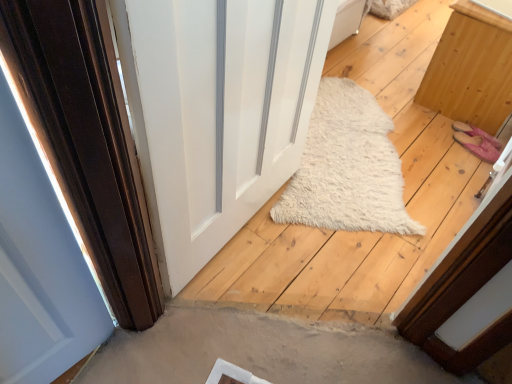
What do you see at coordinates (471, 69) in the screenshot?
I see `light brown wood cabinet at right` at bounding box center [471, 69].

Measure the distance between light brown wood cabinet at right and camera.

The distance of light brown wood cabinet at right from camera is 1.72 meters.

In order to face light brown wood cabinet at right, should I rotate leftwards or rightwards?

Rotate right and turn 29.978 degrees.

The height and width of the screenshot is (384, 512). What are the coordinates of `light brown wood cabinet at right` in the screenshot? It's located at (471, 69).

This screenshot has width=512, height=384. Describe the element at coordinates (217, 112) in the screenshot. I see `white glossy door at center` at that location.

Find the location of a particular element. white glossy door at center is located at coordinates (217, 112).

Where is `light brown wood cabinet at right`? The width and height of the screenshot is (512, 384). light brown wood cabinet at right is located at coordinates (471, 69).

Can you confirm if light brown wood cabinet at right is positioned to the right of white glossy door at center?

Indeed, light brown wood cabinet at right is positioned on the right side of white glossy door at center.

Is light brown wood cabinet at right closer to camera compared to white glossy door at center?

No, light brown wood cabinet at right is further to the viewer.

Is point (443, 110) behind point (305, 75)?

Yes, it is behind point (305, 75).

From the image's perspective, between light brown wood cabinet at right and white glossy door at center, who is located below?

white glossy door at center.

From a real-world perspective, is light brown wood cabinet at right on white glossy door at center?

Incorrect, from a real-world perspective, light brown wood cabinet at right is lower than white glossy door at center.

Considering the relative sizes of light brown wood cabinet at right and white glossy door at center in the image provided, is light brown wood cabinet at right thinner than white glossy door at center?

No.

Does light brown wood cabinet at right have a greater height compared to white glossy door at center?

In fact, light brown wood cabinet at right may be shorter than white glossy door at center.

Is light brown wood cabinet at right smaller than white glossy door at center?

Actually, light brown wood cabinet at right might be larger than white glossy door at center.

Does light brown wood cabinet at right contain white glossy door at center?

No.

Is light brown wood cabinet at right not close to white glossy door at center?

Indeed, light brown wood cabinet at right is not near white glossy door at center.

Is white glossy door at center at the back of light brown wood cabinet at right?

No, light brown wood cabinet at right is not facing away from white glossy door at center.

From the picture: What's the angular difference between light brown wood cabinet at right and white glossy door at center's facing directions?

There is a 2.52-degree angle between the facing directions of light brown wood cabinet at right and white glossy door at center.

Identify the location of door below the light brown wood cabinet at right (from the image's perspective). (217, 112).

Is white glossy door at center to the left of light brown wood cabinet at right from the viewer's perspective?

Indeed, white glossy door at center is positioned on the left side of light brown wood cabinet at right.

Between white glossy door at center and light brown wood cabinet at right, which one is positioned behind?

light brown wood cabinet at right.

Does point (203, 108) appear closer or farther from the camera than point (496, 131)?

Point (203, 108) appears to be closer to the viewer than point (496, 131).

From the image's perspective, is white glossy door at center positioned above or below light brown wood cabinet at right?

From the image's perspective, white glossy door at center appears below light brown wood cabinet at right.

From a real-world perspective, is white glossy door at center over light brown wood cabinet at right?

Yes, from a real-world perspective, white glossy door at center is above light brown wood cabinet at right.

Considering the relative sizes of white glossy door at center and light brown wood cabinet at right in the image provided, is white glossy door at center thinner than light brown wood cabinet at right?

Yes, white glossy door at center is thinner than light brown wood cabinet at right.

Considering the sizes of objects white glossy door at center and light brown wood cabinet at right in the image provided, who is shorter, white glossy door at center or light brown wood cabinet at right?

light brown wood cabinet at right.

Considering the relative sizes of white glossy door at center and light brown wood cabinet at right in the image provided, is white glossy door at center bigger than light brown wood cabinet at right?

Incorrect, white glossy door at center is not larger than light brown wood cabinet at right.

Can light brown wood cabinet at right be found inside white glossy door at center?

Definitely not — light brown wood cabinet at right is not inside white glossy door at center.

Is there a large distance between white glossy door at center and light brown wood cabinet at right?

white glossy door at center is far away from light brown wood cabinet at right.

Is white glossy door at center oriented away from light brown wood cabinet at right?

white glossy door at center is not turned away from light brown wood cabinet at right.

How different are the orientations of white glossy door at center and light brown wood cabinet at right in degrees?

2.52 degrees separate the facing orientations of white glossy door at center and light brown wood cabinet at right.

In order to click on door that appears in front of the light brown wood cabinet at right in this screenshot , I will do `click(217, 112)`.

Identify the location of furniture lying behind the white glossy door at center. (471, 69).

Identify the location of furniture on the right of white glossy door at center. This screenshot has height=384, width=512. (471, 69).